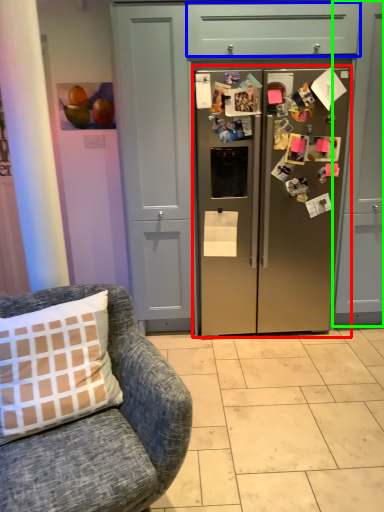
Question: Considering the real-world distances, which object is farthest from refrigerator (highlighted by a red box)? drawer (highlighted by a blue box) or cabinetry (highlighted by a green box)?

Choices:
 (A) drawer
 (B) cabinetry

Answer: (A)